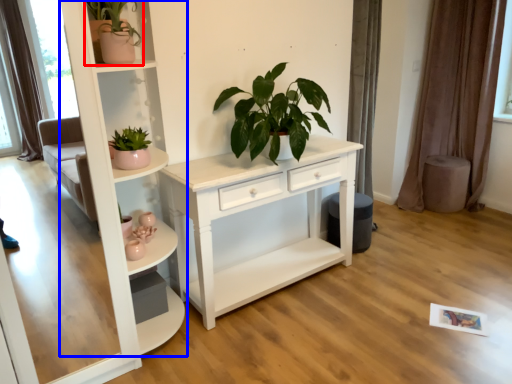
Question: Which point is closer to the camera, houseplant (highlighted by a red box) or shelf (highlighted by a blue box)?

Choices:
 (A) houseplant
 (B) shelf

Answer: (B)